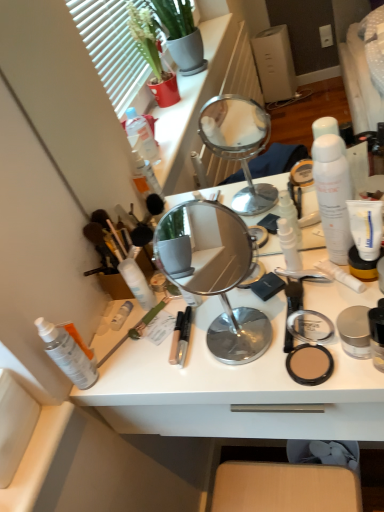
Where is `free area in between matte beige compact at right and white matte spray can at left, which ranks as the 2th toiletry in left-to-right order`? free area in between matte beige compact at right and white matte spray can at left, which ranks as the 2th toiletry in left-to-right order is located at coordinates (203, 368).